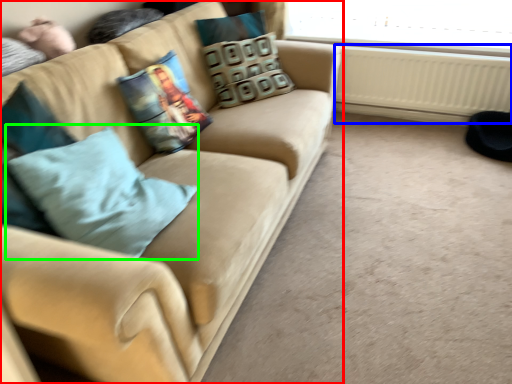
Question: Which is farther away from studio couch (highlighted by a red box)? radiator (highlighted by a blue box) or throw pillow (highlighted by a green box)?

Choices:
 (A) radiator
 (B) throw pillow

Answer: (A)